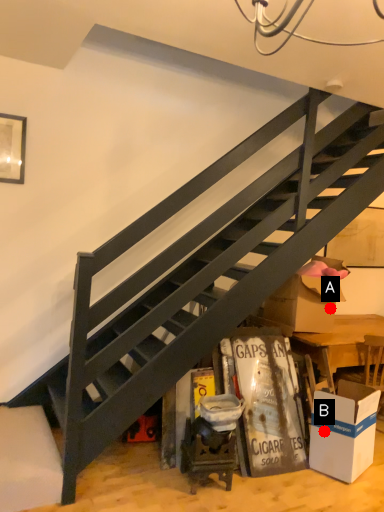
Question: Two points are circled on the image, labeled by A and B beside each circle. Which point is closer to the camera?

Choices:
 (A) A is closer
 (B) B is closer

Answer: (B)